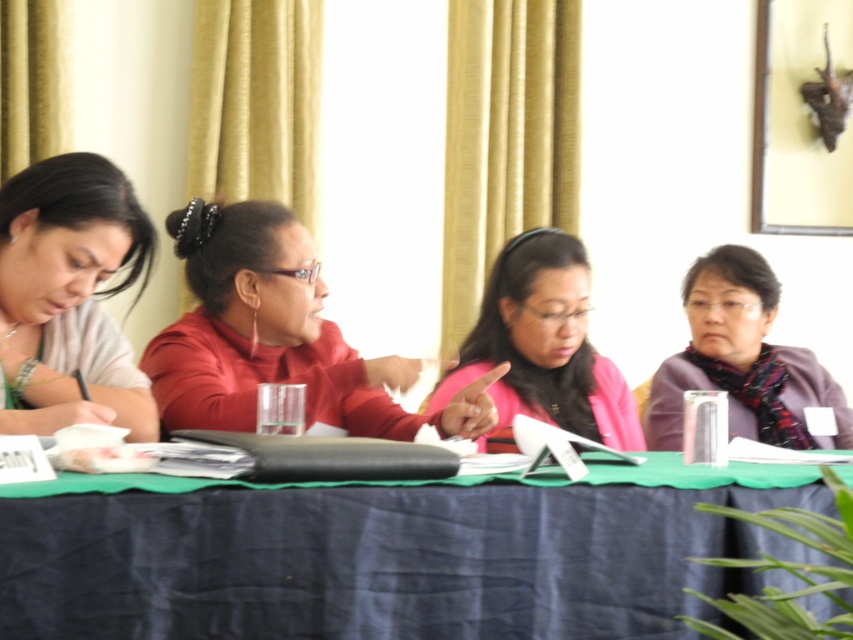
Does point (482, 577) come in front of point (242, 308)?

Yes, it is in front of point (242, 308).

Does blue fabric tablecloth at center have a greater width compared to matte red shirt at center?

Yes.

Where is `blue fabric tablecloth at center`? The height and width of the screenshot is (640, 853). blue fabric tablecloth at center is located at coordinates (387, 554).

This screenshot has width=853, height=640. What do you see at coordinates (277, 337) in the screenshot?
I see `matte red shirt at center` at bounding box center [277, 337].

Identify the location of matte red shirt at center. The width and height of the screenshot is (853, 640). (277, 337).

Between point (239, 410) and point (521, 232), which one is positioned in front?

Positioned in front is point (239, 410).

Where is `matte red shirt at center`? This screenshot has width=853, height=640. matte red shirt at center is located at coordinates (277, 337).

Is matte white shirt at left wider than purple scarf at right?

In fact, matte white shirt at left might be narrower than purple scarf at right.

Looking at this image, does matte white shirt at left have a lesser height compared to purple scarf at right?

Yes, matte white shirt at left is shorter than purple scarf at right.

Where is `matte white shirt at left`? This screenshot has height=640, width=853. matte white shirt at left is located at coordinates (67, 288).